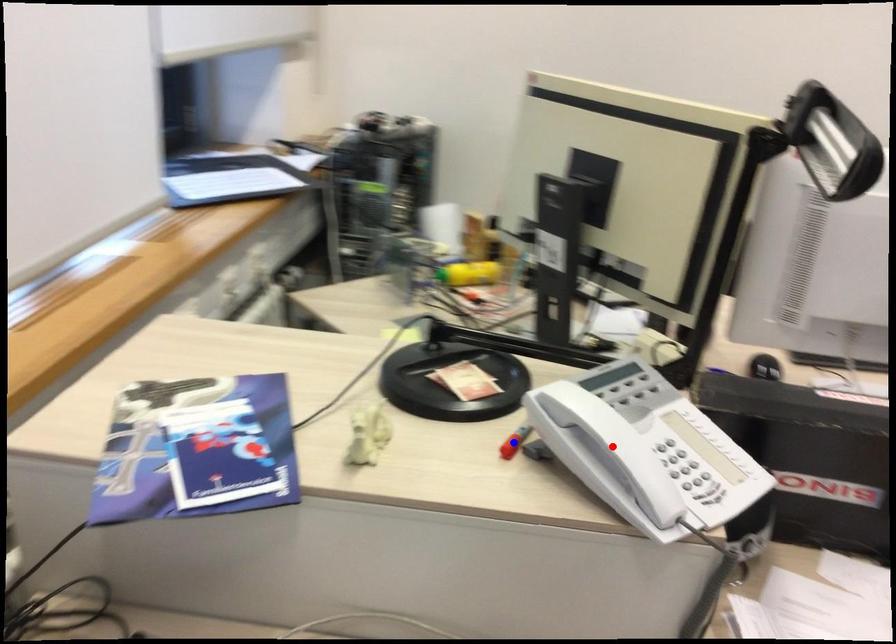
Question: Which of the two points in the image is closer to the camera?

Choices:
 (A) Blue point is closer.
 (B) Red point is closer.

Answer: (B)